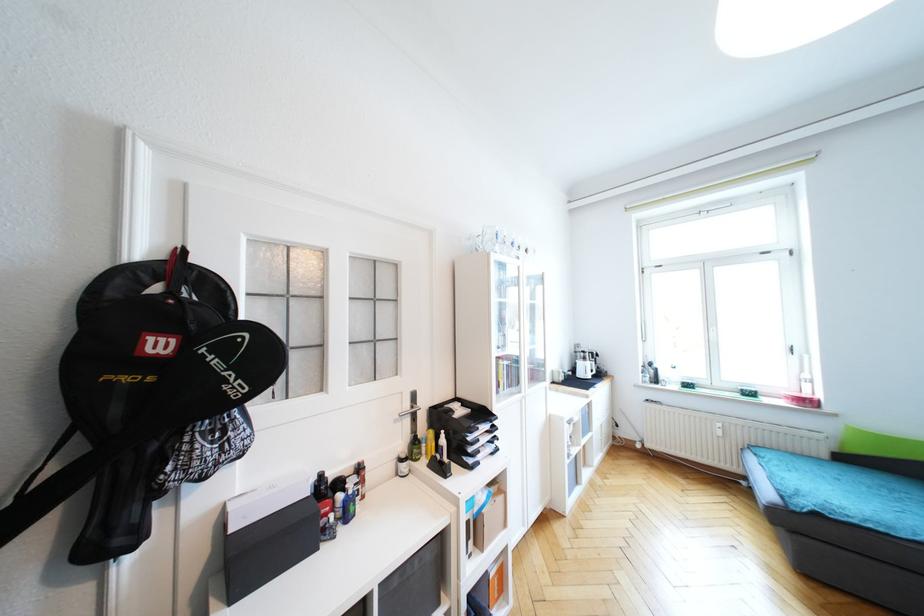
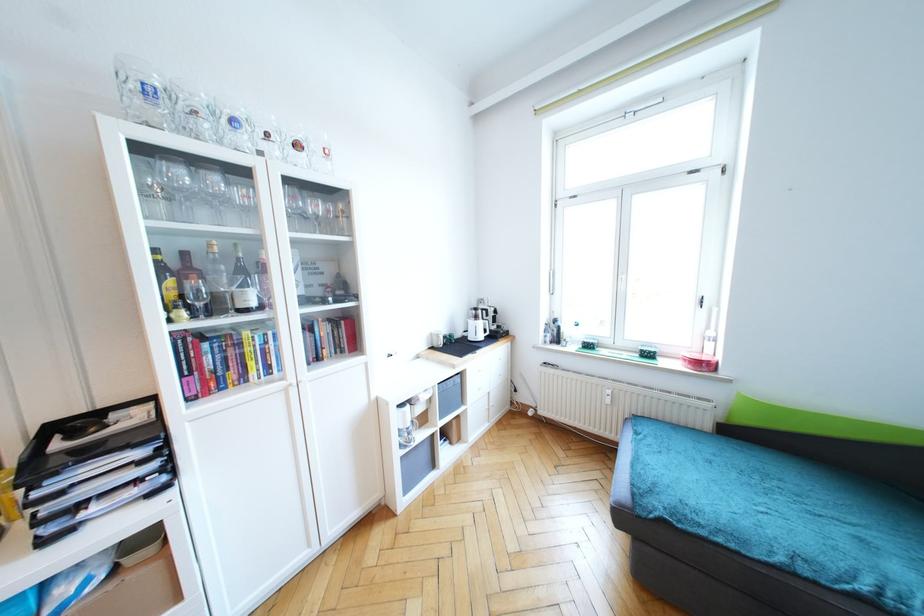
The images are taken continuously from a first-person perspective. In which direction are you moving?

Result: The cameraman walked toward right, forward.